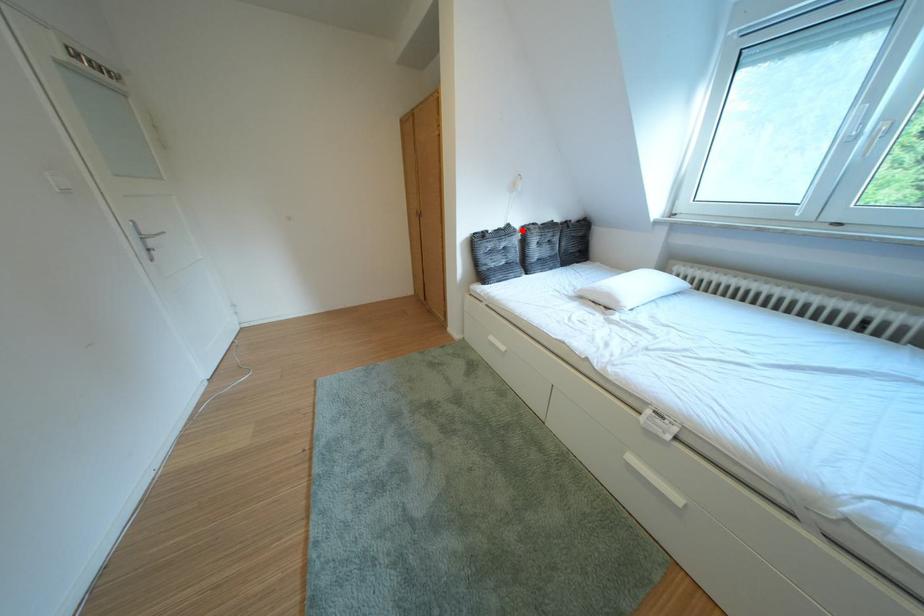
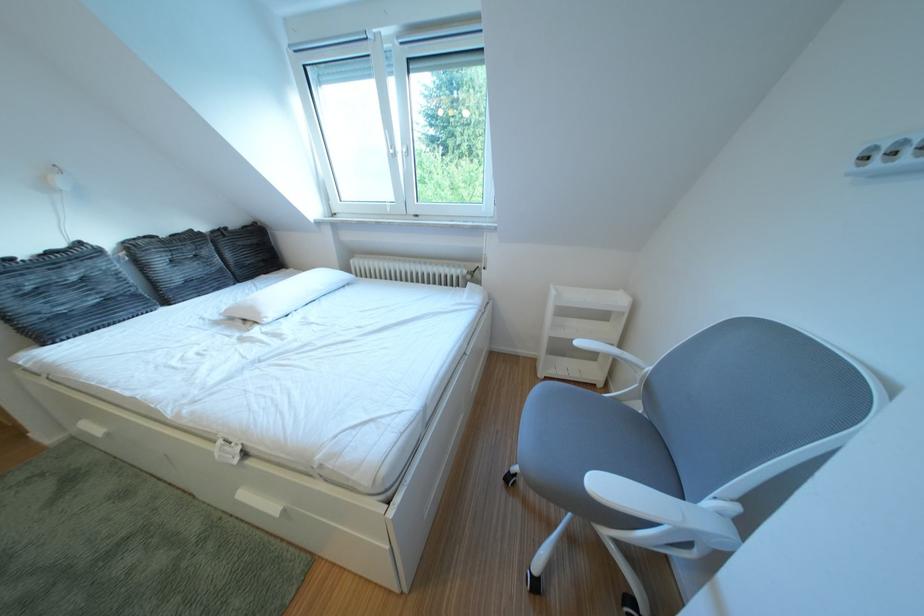
Question: I am providing you with two images of the same scene from different viewpoints. Given a red point in image1, look at the same physical point in image2. Is it:

Choices:
 (A) Closer to the viewpoint
 (B) Farther from the viewpoint

Answer: (B)